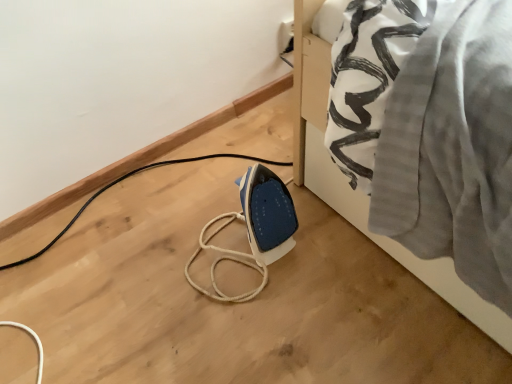
You are a GUI agent. You are given a task and a screenshot of the screen. Output one action in this format:
    pyautogui.click(x=<x>, y=<y>)
    Task: Click on the white fabric at lower right
    
    Given the screenshot: What is the action you would take?
    pyautogui.click(x=362, y=193)

What do you see at coordinates (362, 193) in the screenshot? Image resolution: width=512 pixels, height=384 pixels. I see `white fabric at lower right` at bounding box center [362, 193].

This screenshot has height=384, width=512. I want to click on white fabric at lower right, so click(x=362, y=193).